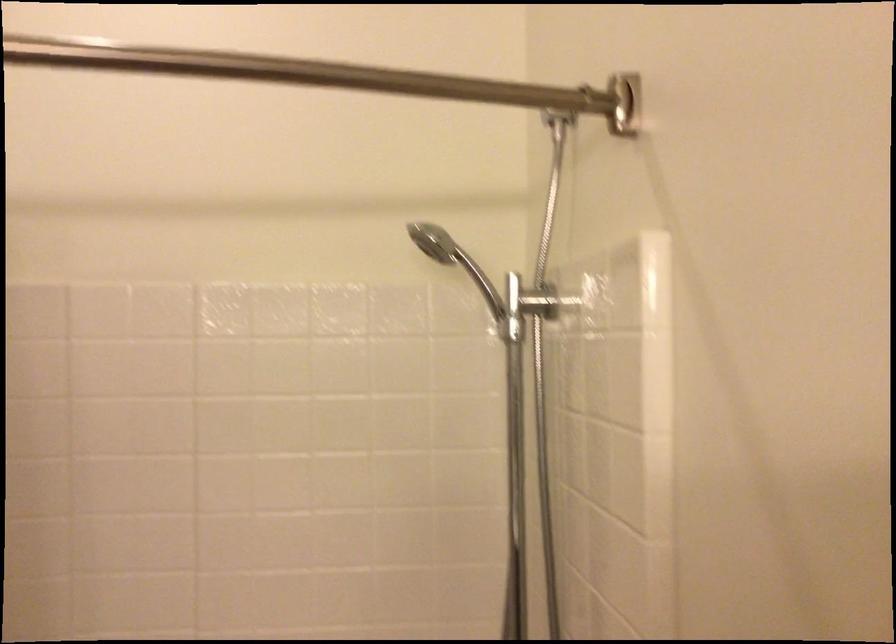
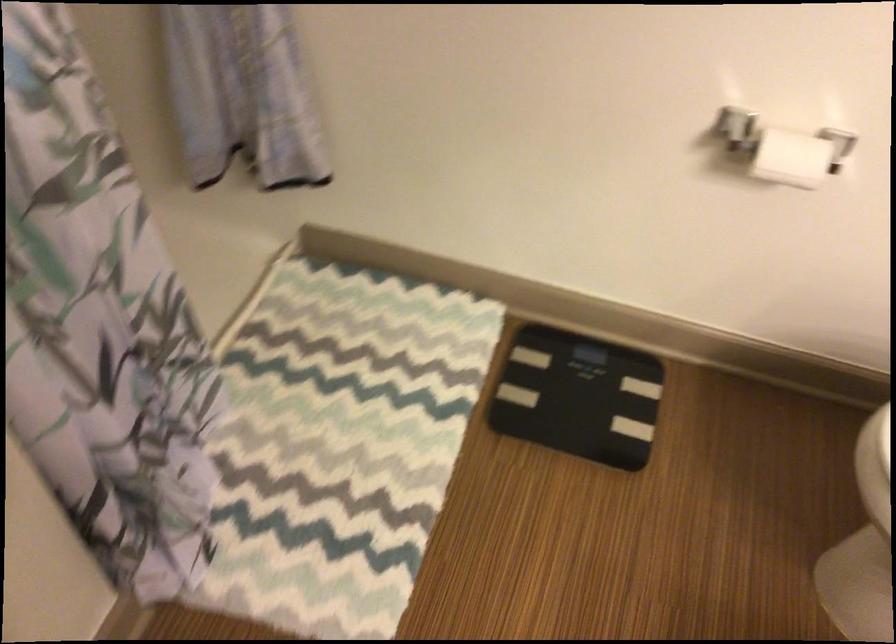
The first image is from the beginning of the video and the second image is from the end. How did the camera likely rotate when shooting the video?

The rotation direction of the camera is right-down.